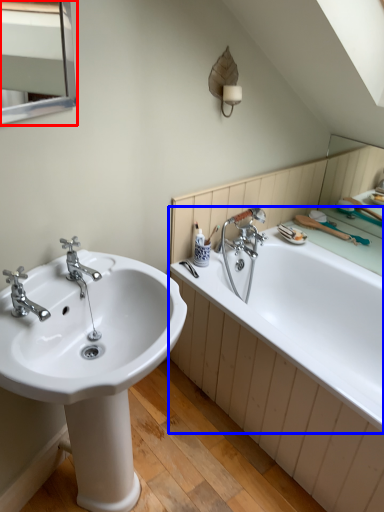
Question: Among these objects, which one is farthest to the camera, medicine cabinet (highlighted by a red box) or bathtub (highlighted by a blue box)?

Choices:
 (A) medicine cabinet
 (B) bathtub

Answer: (B)